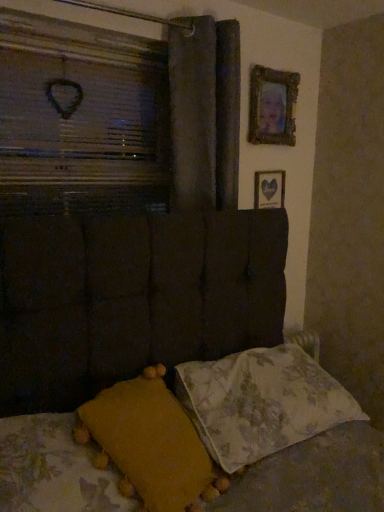
Question: Should I look upward or downward to see floral fabric pillow at lower right, which is the 1th pillow in right-to-left order?

Choices:
 (A) up
 (B) down

Answer: (B)

Question: Are gold-framed picture at upper right, the 1th picture frame in the top-to-bottom sequence, and wooden picture frame at upper right, which is the first picture frame from bottom to top, far apart?

Choices:
 (A) yes
 (B) no

Answer: (B)

Question: From a real-world perspective, does gold-framed picture at upper right, which ranks as the second picture frame in bottom-to-top order, stand above wooden picture frame at upper right, which is the first picture frame from bottom to top?

Choices:
 (A) yes
 (B) no

Answer: (A)

Question: From the image's perspective, does gold-framed picture at upper right, the 1th picture frame in the top-to-bottom sequence, appear lower than wooden picture frame at upper right, placed as the 2th picture frame when sorted from top to bottom?

Choices:
 (A) no
 (B) yes

Answer: (A)

Question: Is gold-framed picture at upper right, which ranks as the second picture frame in bottom-to-top order, thinner than wooden picture frame at upper right, placed as the 2th picture frame when sorted from top to bottom?

Choices:
 (A) yes
 (B) no

Answer: (B)

Question: Is wooden picture frame at upper right, placed as the 2th picture frame when sorted from top to bottom, inside gold-framed picture at upper right, which ranks as the second picture frame in bottom-to-top order?

Choices:
 (A) yes
 (B) no

Answer: (B)

Question: Does gold-framed picture at upper right, which ranks as the second picture frame in bottom-to-top order, appear on the left side of wooden picture frame at upper right, which is the first picture frame from bottom to top?

Choices:
 (A) no
 (B) yes

Answer: (B)

Question: Is gold-framed picture at upper right, which ranks as the second picture frame in bottom-to-top order, turned away from mustard yellow fabric pillow at lower left, which is counted as the first pillow, starting from the left?

Choices:
 (A) yes
 (B) no

Answer: (B)

Question: From the image's perspective, does gold-framed picture at upper right, the 1th picture frame in the top-to-bottom sequence, appear lower than mustard yellow fabric pillow at lower left, which appears as the 2th pillow when viewed from the right?

Choices:
 (A) yes
 (B) no

Answer: (B)

Question: Considering the relative sizes of gold-framed picture at upper right, the 1th picture frame in the top-to-bottom sequence, and mustard yellow fabric pillow at lower left, which is counted as the first pillow, starting from the left, in the image provided, is gold-framed picture at upper right, the 1th picture frame in the top-to-bottom sequence, taller than mustard yellow fabric pillow at lower left, which is counted as the first pillow, starting from the left,?

Choices:
 (A) no
 (B) yes

Answer: (B)

Question: Can you confirm if gold-framed picture at upper right, which ranks as the second picture frame in bottom-to-top order, is positioned to the left of mustard yellow fabric pillow at lower left, which is counted as the first pillow, starting from the left?

Choices:
 (A) yes
 (B) no

Answer: (B)

Question: Is mustard yellow fabric pillow at lower left, which is counted as the first pillow, starting from the left, inside gold-framed picture at upper right, the 1th picture frame in the top-to-bottom sequence?

Choices:
 (A) no
 (B) yes

Answer: (A)

Question: Does gold-framed picture at upper right, which ranks as the second picture frame in bottom-to-top order, touch mustard yellow fabric pillow at lower left, which appears as the 2th pillow when viewed from the right?

Choices:
 (A) yes
 (B) no

Answer: (B)

Question: From a real-world perspective, is wooden picture frame at upper right, which is the first picture frame from bottom to top, physically above dark fabric curtain at upper center?

Choices:
 (A) yes
 (B) no

Answer: (B)